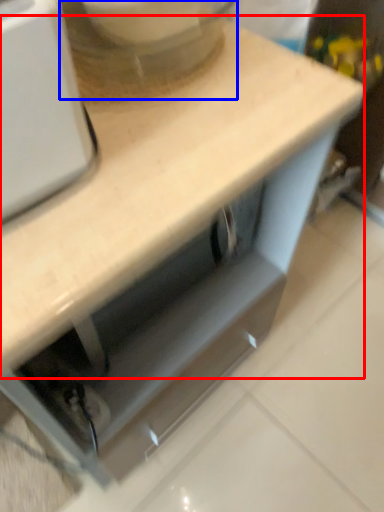
Question: Which object appears farthest to the camera in this image, countertop (highlighted by a red box) or mixer (highlighted by a blue box)?

Choices:
 (A) countertop
 (B) mixer

Answer: (B)